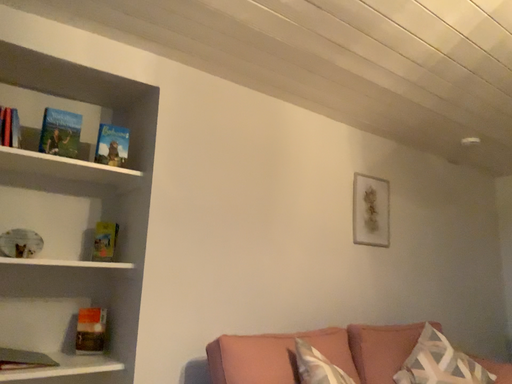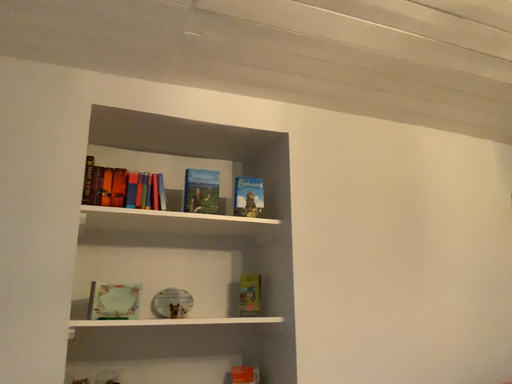
Question: How did the camera likely rotate when shooting the video?

Choices:
 (A) rotated right
 (B) rotated left

Answer: (B)